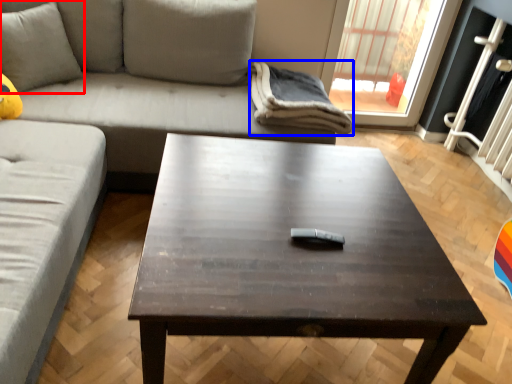
Question: Which object appears closest to the camera in this image, pillow (highlighted by a red box) or blanket (highlighted by a blue box)?

Choices:
 (A) pillow
 (B) blanket

Answer: (A)